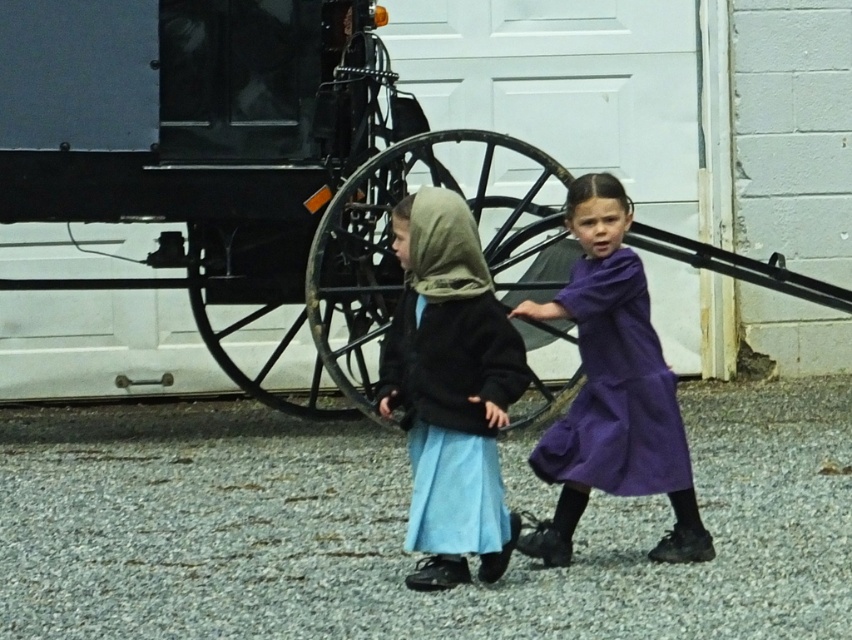
What object is located at the coordinates point (450, 390) in the image?

The point (450, 390) indicates the location of the matte black jacket at center.

You are a delivery person who needs to park your bike near the black matte horse cart at center without blocking the path. Where should you position your bike relative to the horse cart?

The black matte horse cart at center is located at point [403,179]. To park your bike without blocking the path, position it to the side of the horse cart, ensuring it doesn